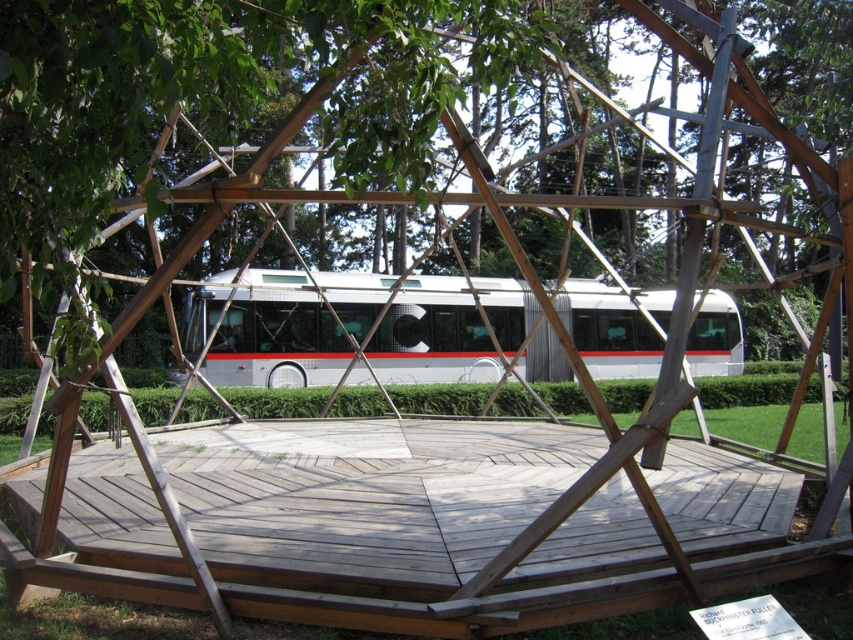
Find the location of a particular element. green leafy tree at center is located at coordinates coord(212,92).

Does green leafy tree at center lie behind white metallic bus at center?

No, it is not.

Which is in front, point (370, 125) or point (688, 362)?

Point (370, 125)

I want to click on green leafy tree at center, so click(212, 92).